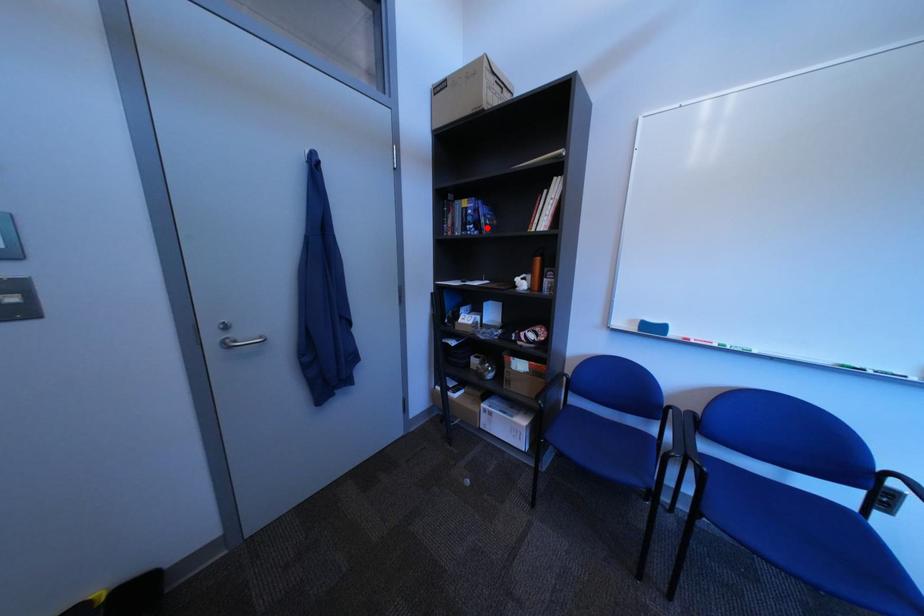
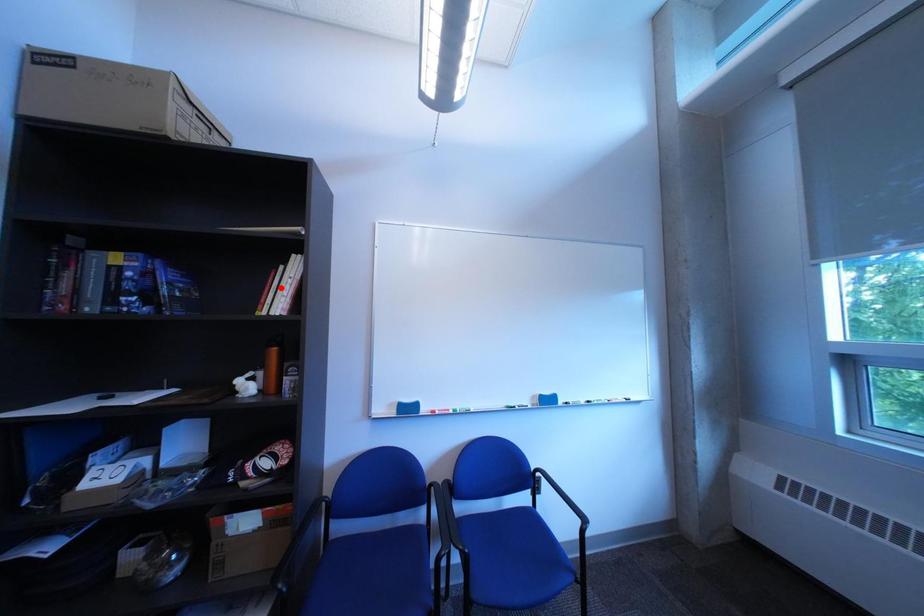
I am providing you with two images of the same scene from different viewpoints. A red point is marked on the first image and another point is marked on the second image. Does the point marked in image1 correspond to the same location as the one in image2?

No